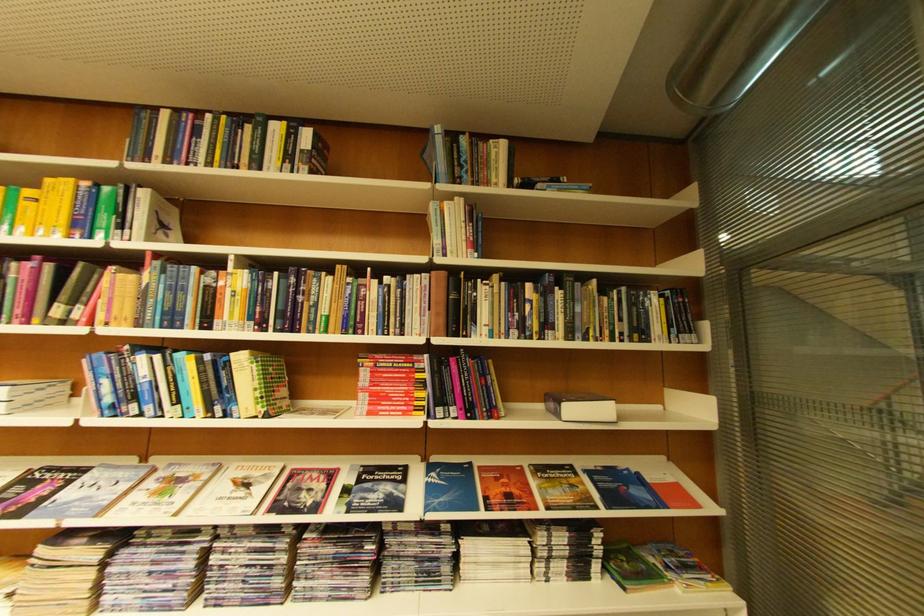
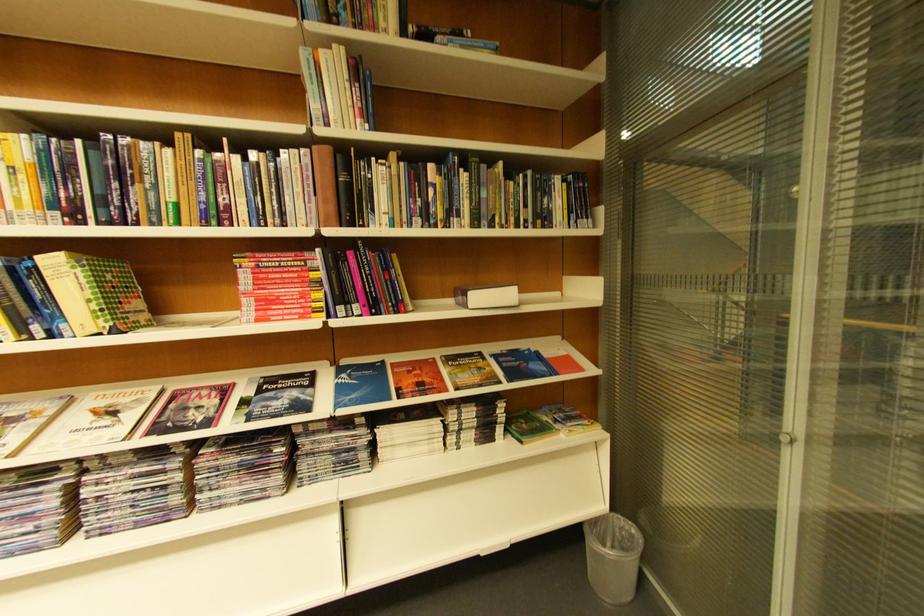
Find the pixel in the second image that matches the point at 251,360 in the first image.

(63, 264)